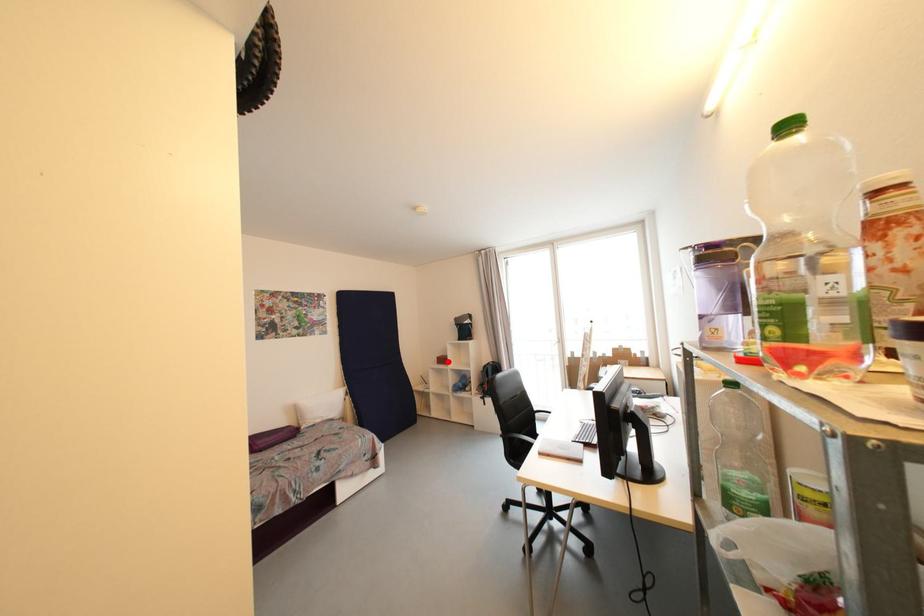
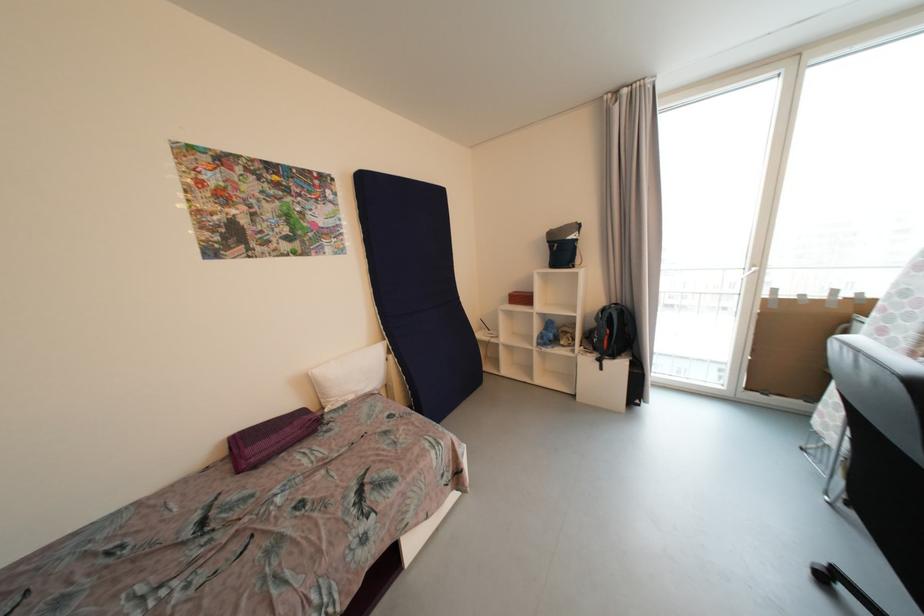
Question: A red point is marked in image1. In image2, is the corresponding 3D point closer to the camera or farther? Reply with the corresponding letter.

Choices:
 (A) The corresponding 3D point is closer.
 (B) The corresponding 3D point is farther.

Answer: (A)